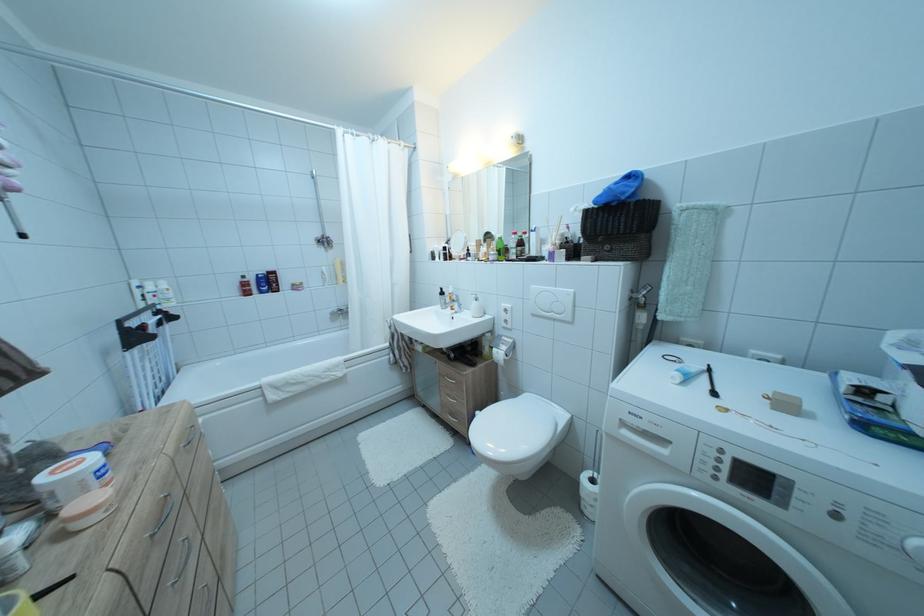
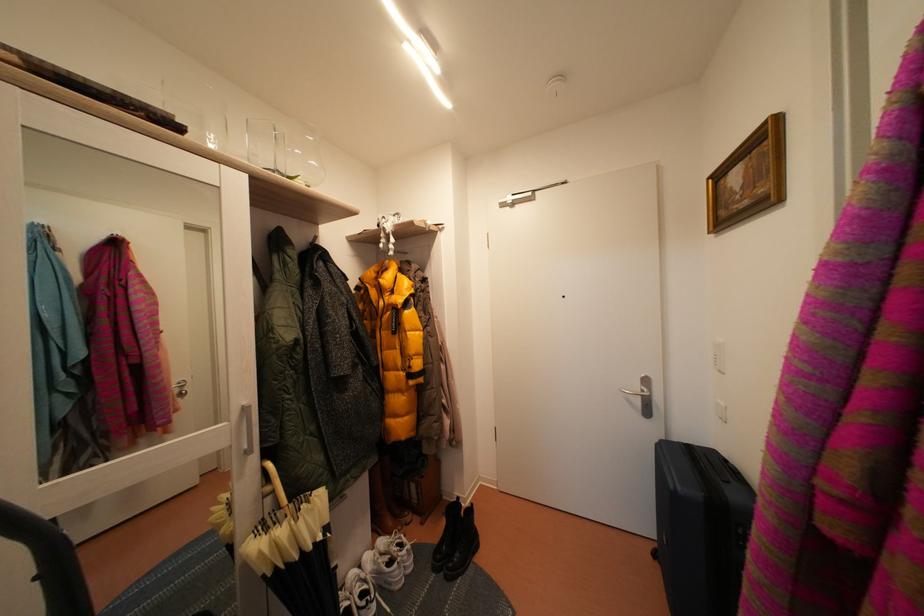
Question: The camera is either moving clockwise (left) or counter-clockwise (right) around the object. The first image is from the beginning of the video and the second image is from the end. Is the camera moving left or right when shooting the video?

Choices:
 (A) Left
 (B) Right

Answer: (A)